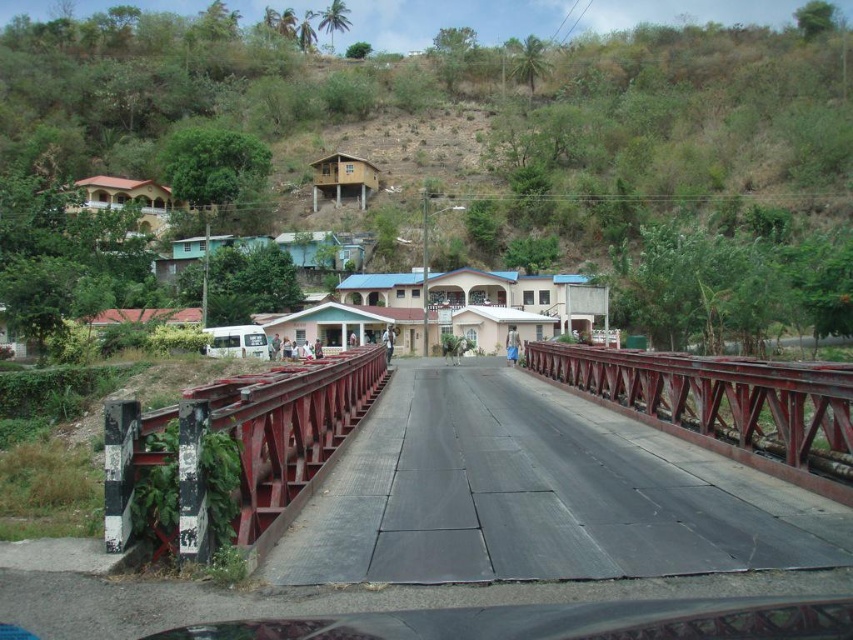
Can you confirm if metallic bridge at center is smaller than rusty metal bridge at left?

Incorrect, metallic bridge at center is not smaller in size than rusty metal bridge at left.

Which is in front, point (270, 412) or point (376, 390)?

Positioned in front is point (270, 412).

Which is behind, point (219, 401) or point (286, 480)?

The point (286, 480) is more distant.

This screenshot has width=853, height=640. I want to click on metallic bridge at center, so click(555, 525).